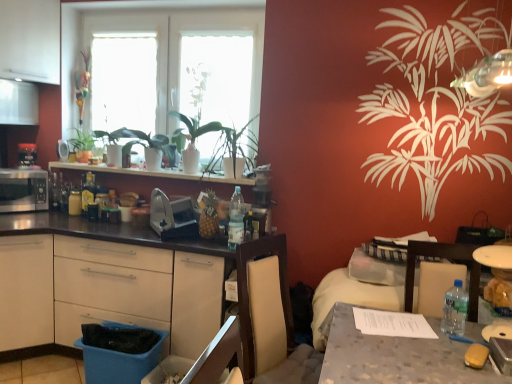
At what (x,y) coordinates should I click in order to perform the action: click on free space above white glass window at upper center (from a real-world perspective). Please return your answer as a coordinate pair (x, y). The height and width of the screenshot is (384, 512). Looking at the image, I should click on (165, 9).